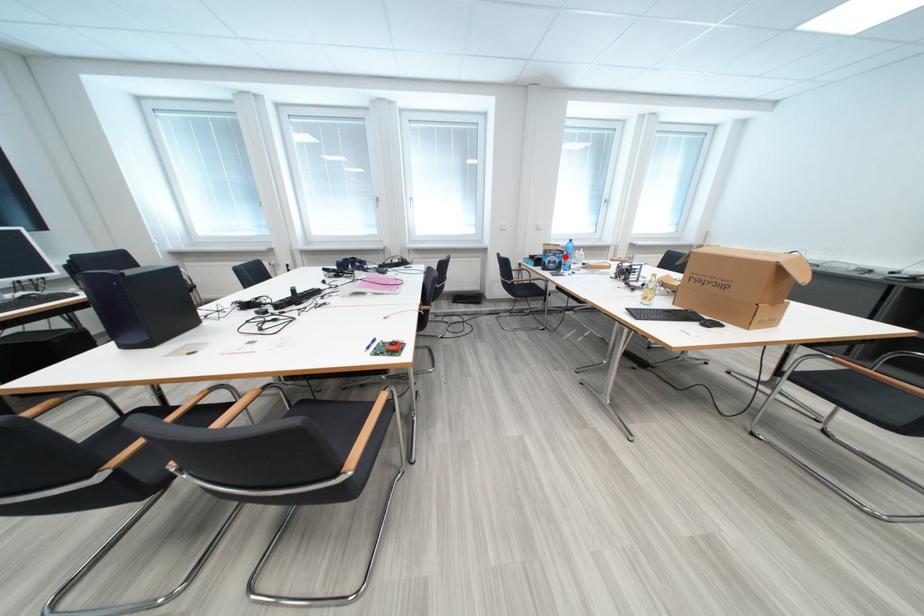
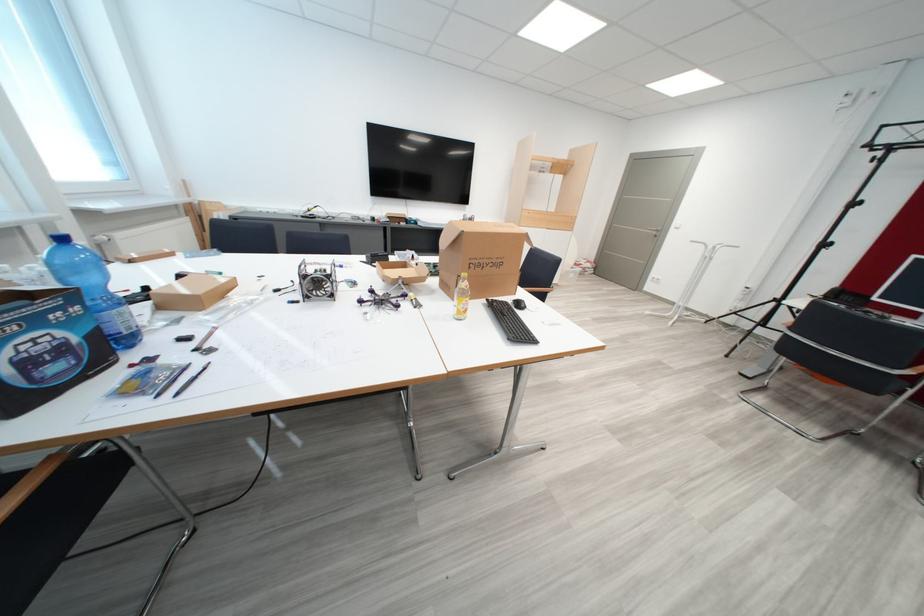
Question: I am providing you with two images of the same scene from different viewpoints. Given a red point in image1, look at the same physical point in image2. Is it:

Choices:
 (A) Closer to the viewpoint
 (B) Farther from the viewpoint

Answer: (B)